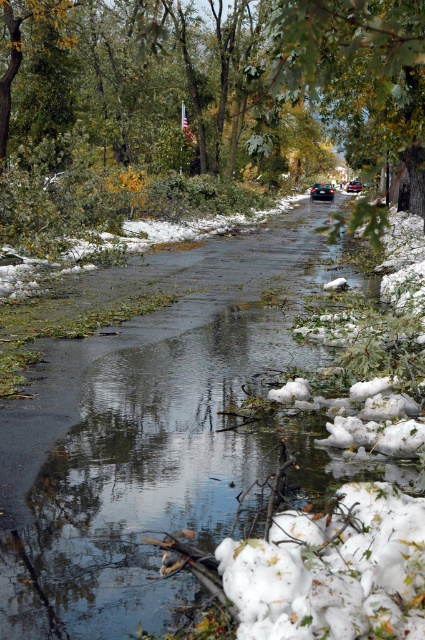
Question: Does black matte car at center appear on the right side of metallic red car at center?

Choices:
 (A) yes
 (B) no

Answer: (B)

Question: Can you confirm if black matte car at center is thinner than metallic red car at center?

Choices:
 (A) no
 (B) yes

Answer: (A)

Question: Considering the relative positions of black matte car at center and metallic red car at center in the image provided, where is black matte car at center located with respect to metallic red car at center?

Choices:
 (A) below
 (B) above

Answer: (A)

Question: Which point is farther to the camera?

Choices:
 (A) coord(317,184)
 (B) coord(357,182)

Answer: (B)

Question: Which point is closer to the camera?

Choices:
 (A) (326, 188)
 (B) (351, 188)

Answer: (A)